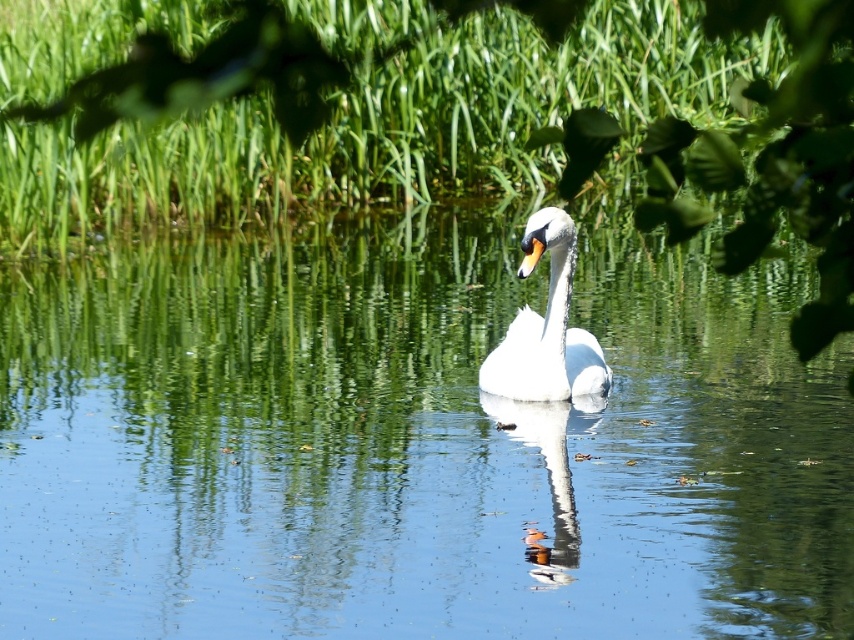
Between clear water at center and white glossy swan at center, which one has more height?

Standing taller between the two is white glossy swan at center.

Looking at this image, is clear water at center positioned behind white glossy swan at center?

Yes, it is behind white glossy swan at center.

Is point (344, 403) closer to viewer compared to point (566, 304)?

No.

In order to click on clear water at center in this screenshot , I will do `click(413, 444)`.